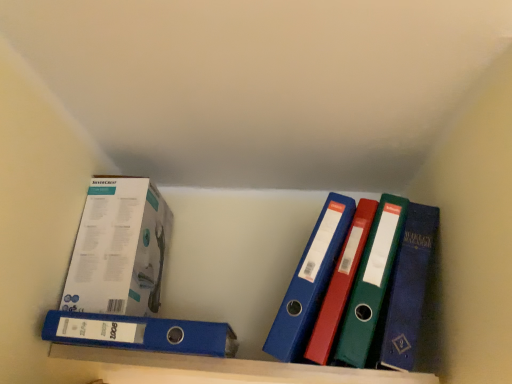
Question: Does blue plastic shelf at lower center have a lesser width compared to white cardboard box at upper left?

Choices:
 (A) yes
 (B) no

Answer: (A)

Question: From the image's perspective, does blue plastic shelf at lower center appear higher than white cardboard box at upper left?

Choices:
 (A) yes
 (B) no

Answer: (B)

Question: Considering the relative sizes of blue plastic shelf at lower center and white cardboard box at upper left in the image provided, is blue plastic shelf at lower center shorter than white cardboard box at upper left?

Choices:
 (A) yes
 (B) no

Answer: (A)

Question: Does blue plastic shelf at lower center have a smaller size compared to white cardboard box at upper left?

Choices:
 (A) yes
 (B) no

Answer: (A)

Question: Is white cardboard box at upper left at the back of blue plastic shelf at lower center?

Choices:
 (A) yes
 (B) no

Answer: (B)

Question: In terms of width, does blue plastic shelf at lower center look wider or thinner when compared to blue plastic binder at lower left?

Choices:
 (A) thin
 (B) wide

Answer: (A)

Question: From their relative heights in the image, would you say blue plastic shelf at lower center is taller or shorter than blue plastic binder at lower left?

Choices:
 (A) short
 (B) tall

Answer: (A)

Question: Is blue plastic shelf at lower center in front of or behind blue plastic binder at lower left in the image?

Choices:
 (A) front
 (B) behind

Answer: (B)

Question: From the image's perspective, is blue plastic shelf at lower center located above or below blue plastic binder at lower left?

Choices:
 (A) below
 (B) above

Answer: (A)

Question: From their relative heights in the image, would you say white cardboard box at upper left is taller or shorter than blue plastic binder at lower left?

Choices:
 (A) short
 (B) tall

Answer: (B)

Question: Is white cardboard box at upper left bigger or smaller than blue plastic binder at lower left?

Choices:
 (A) big
 (B) small

Answer: (A)

Question: Would you say white cardboard box at upper left is inside or outside blue plastic binder at lower left?

Choices:
 (A) inside
 (B) outside

Answer: (B)

Question: Is white cardboard box at upper left to the left or to the right of blue plastic binder at lower left in the image?

Choices:
 (A) right
 (B) left

Answer: (B)

Question: Considering the relative positions of white cardboard box at upper left and blue plastic shelf at lower center in the image provided, is white cardboard box at upper left to the left or to the right of blue plastic shelf at lower center?

Choices:
 (A) right
 (B) left

Answer: (B)

Question: Does point (89, 200) appear closer or farther from the camera than point (252, 372)?

Choices:
 (A) farther
 (B) closer

Answer: (A)